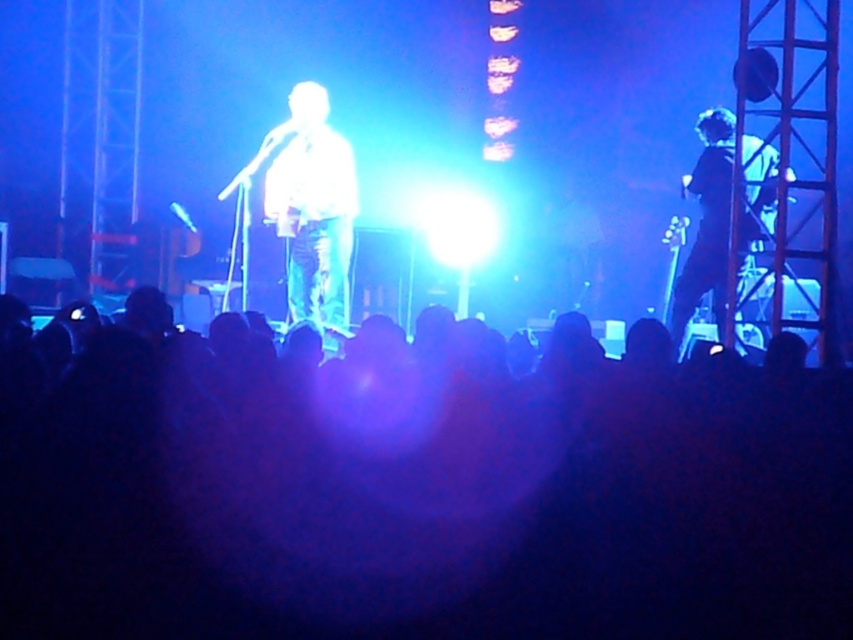
Question: Which object is positioned farthest from the black matte crowd at center?

Choices:
 (A) dark blue jeans at right
 (B) white glossy shirt at center

Answer: (B)

Question: Is black matte crowd at center wider than white glossy shirt at center?

Choices:
 (A) no
 (B) yes

Answer: (B)

Question: Which object appears farthest from the camera in this image?

Choices:
 (A) white glossy shirt at center
 (B) black matte crowd at center

Answer: (A)

Question: Does white glossy shirt at center lie behind dark blue jeans at right?

Choices:
 (A) yes
 (B) no

Answer: (A)

Question: Can you confirm if white glossy shirt at center is positioned to the left of dark blue jeans at right?

Choices:
 (A) no
 (B) yes

Answer: (B)

Question: Which point is closer to the camera?

Choices:
 (A) (306, 148)
 (B) (718, 252)
 (C) (204, 625)

Answer: (C)